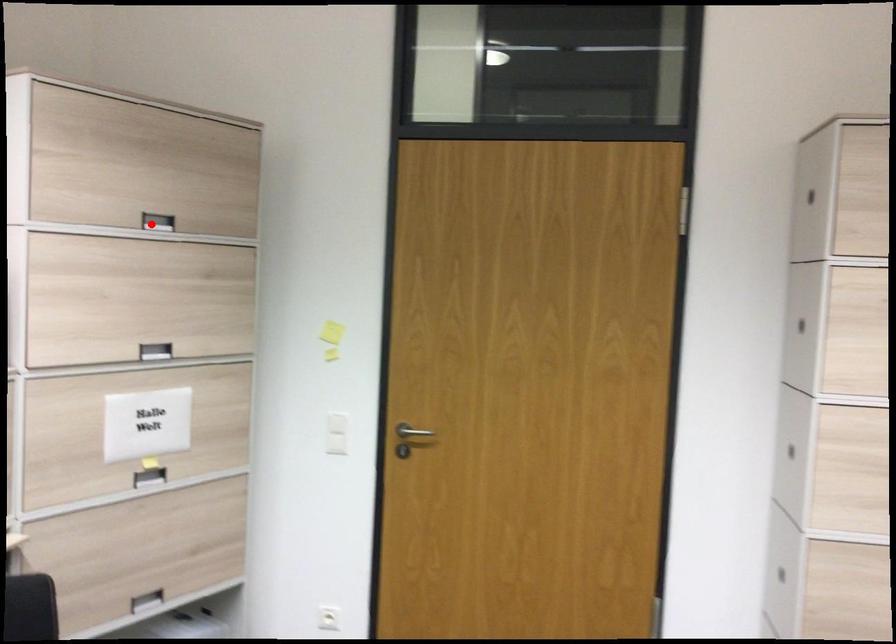
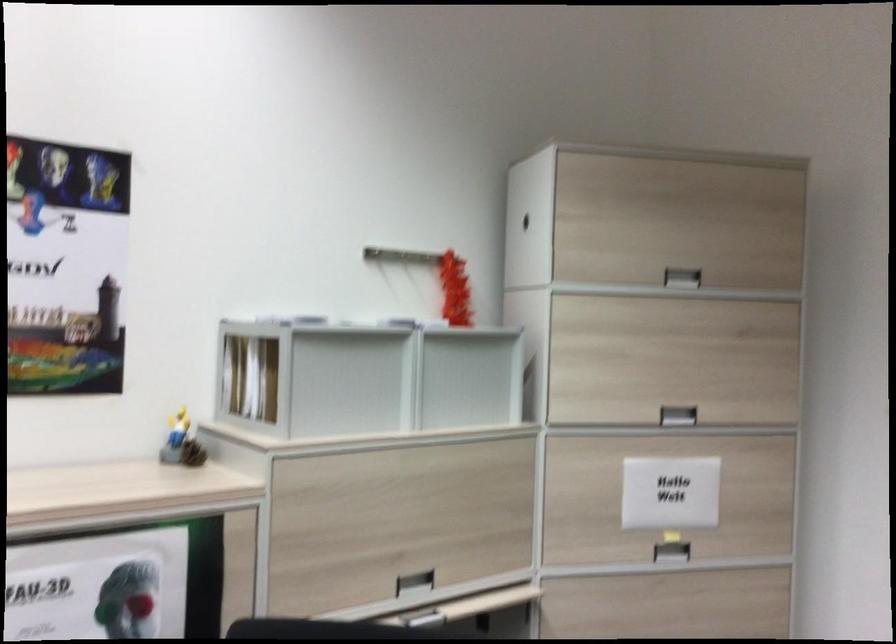
Where in the second image is the point corresponding to the highlighted location from the first image?

(682, 277)